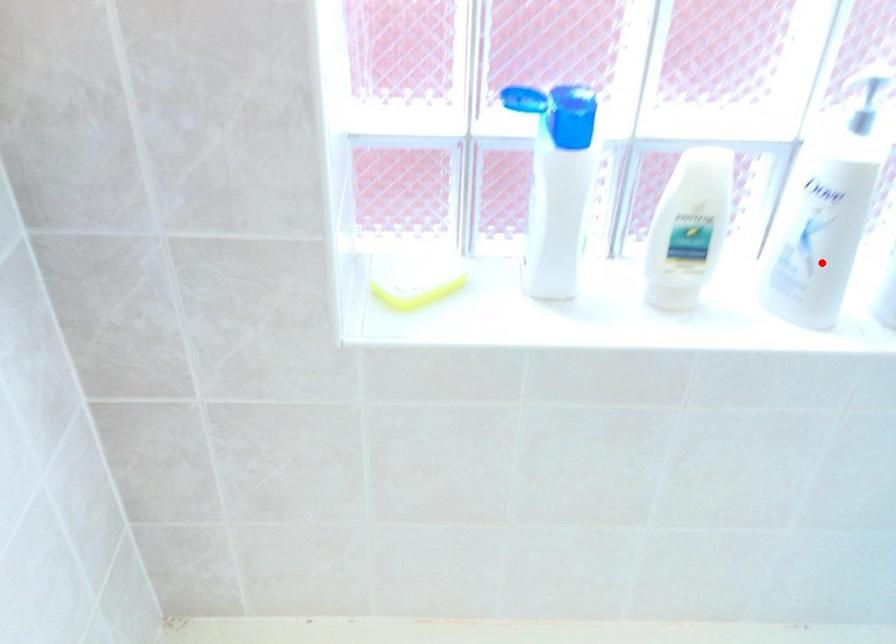
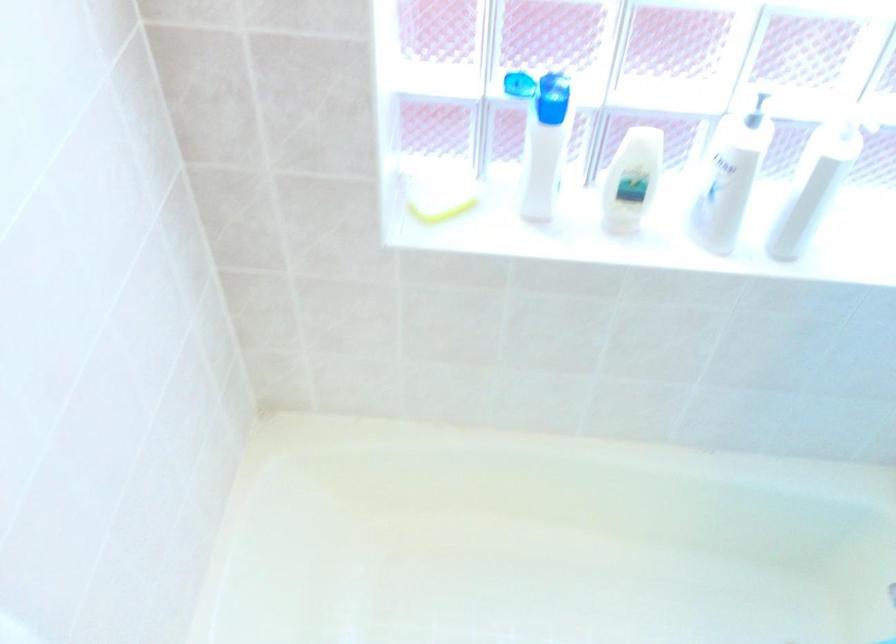
Question: A red point is marked in image1. In image2, is the corresponding 3D point closer to the camera or farther? Reply with the corresponding letter.

Choices:
 (A) The corresponding 3D point is closer.
 (B) The corresponding 3D point is farther.

Answer: (B)